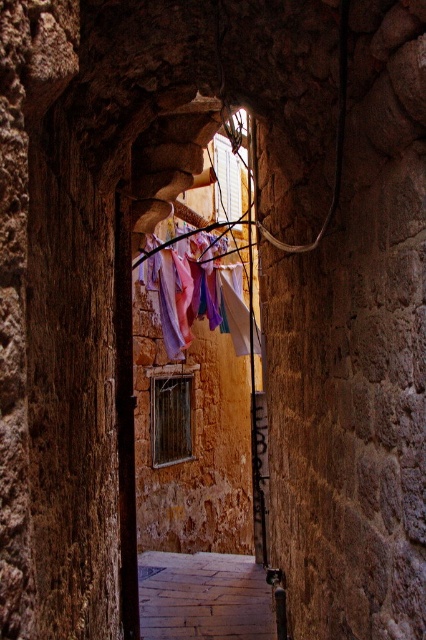
Question: Is smooth stone alley at center bigger than pastel fabric at center?

Choices:
 (A) no
 (B) yes

Answer: (A)

Question: Does smooth stone alley at center appear on the right side of pastel fabric at center?

Choices:
 (A) yes
 (B) no

Answer: (A)

Question: Can you confirm if smooth stone alley at center is positioned to the right of pastel fabric at center?

Choices:
 (A) yes
 (B) no

Answer: (A)

Question: Which object appears closest to the camera in this image?

Choices:
 (A) smooth stone alley at center
 (B) pastel fabric at center

Answer: (A)